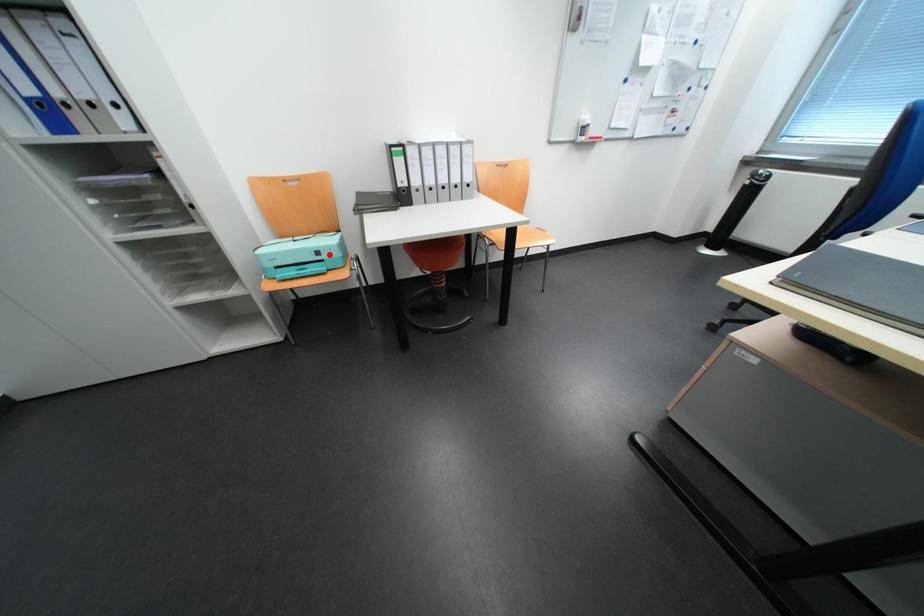
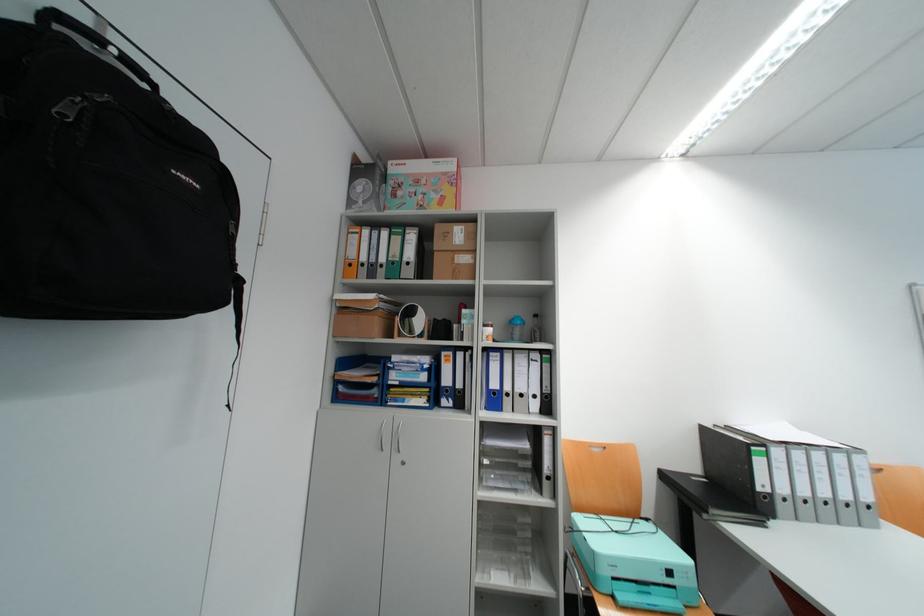
Question: I am providing you with two images of the same scene from different viewpoints. Image1 has a red point marked. In image2, the corresponding 3D location appears at what relative position? Reply with the corresponding letter.

Choices:
 (A) Closer
 (B) Farther

Answer: (B)